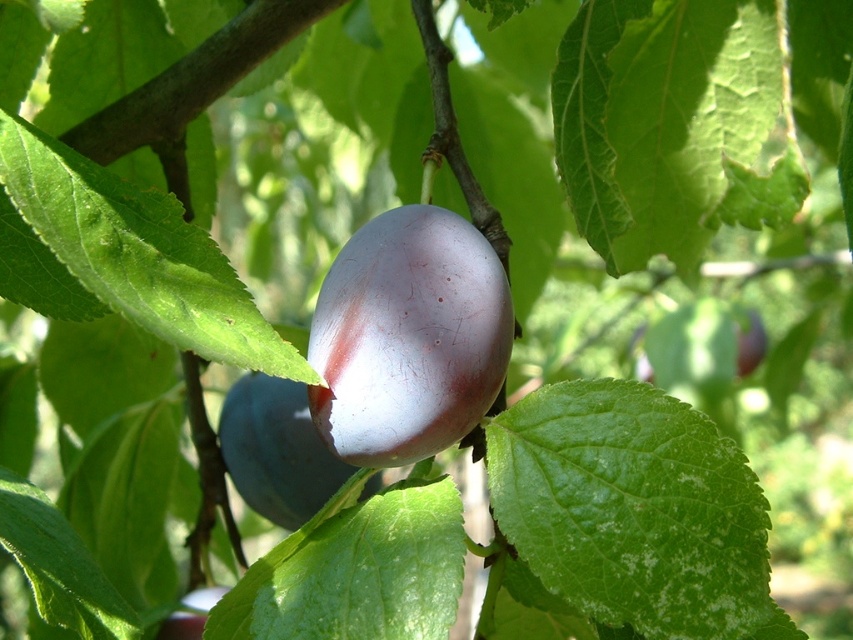
Is point (331, 282) positioned behind point (321, 483)?

No, it is not.

Is purple glossy plum at center closer to camera compared to shiny purple plum at center?

That is True.

Does point (432, 413) come behind point (271, 396)?

No, (432, 413) is closer to viewer.

The image size is (853, 640). Identify the location of purple glossy plum at center. (408, 337).